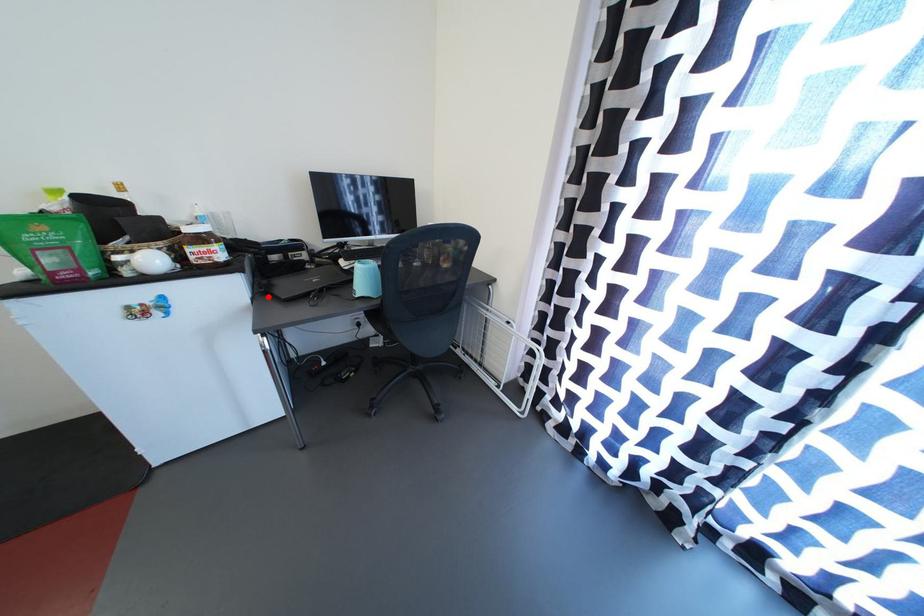
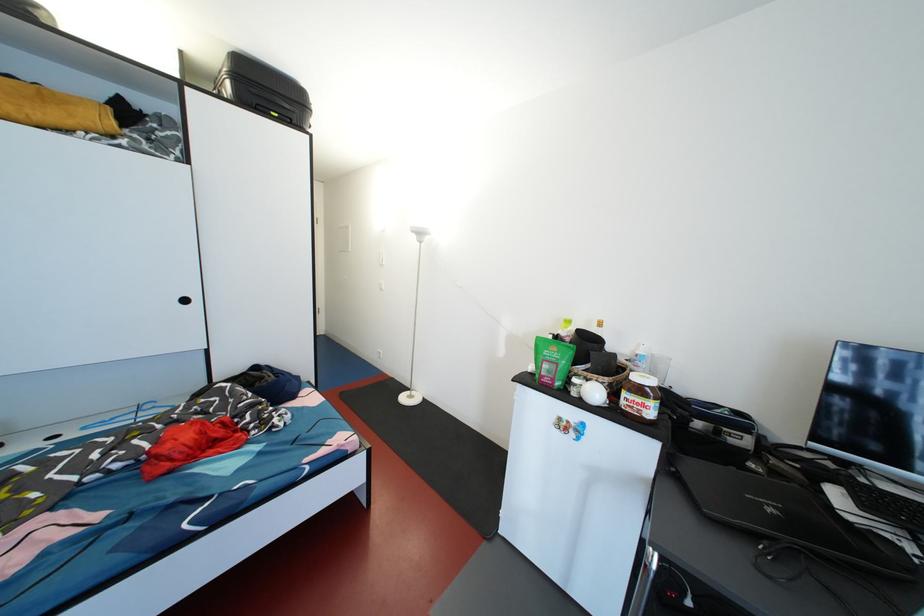
Where in the second image is the point corresponding to the highlighted location from the first image?

(675, 474)